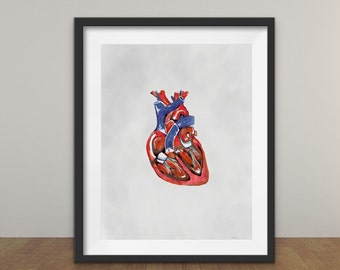
You are a GUI agent. You are given a task and a screenshot of the screen. Output one action in this format:
    pyautogui.click(x=<x>, y=<y>)
    Task: Click on the floor
    
    Given the screenshot: What is the action you would take?
    pyautogui.click(x=317, y=247)